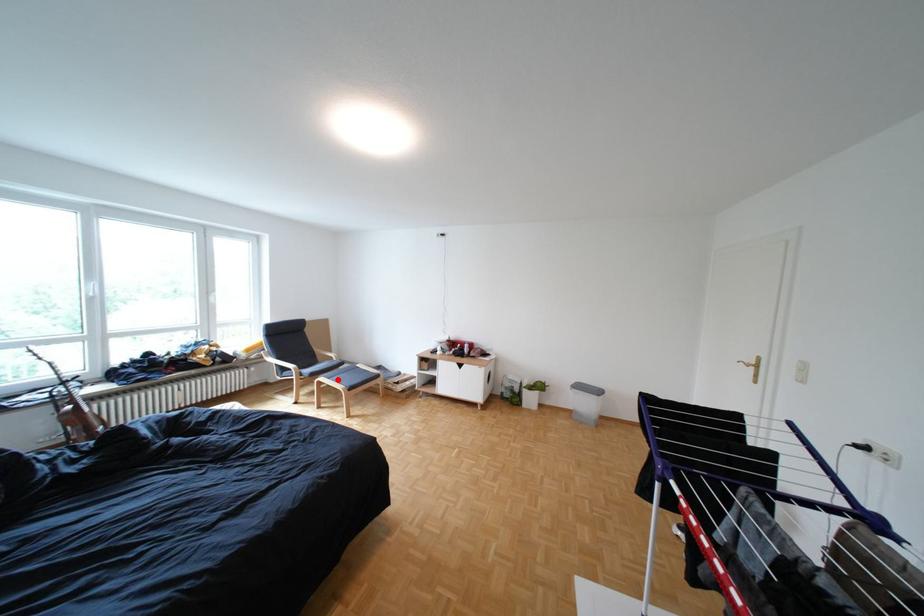
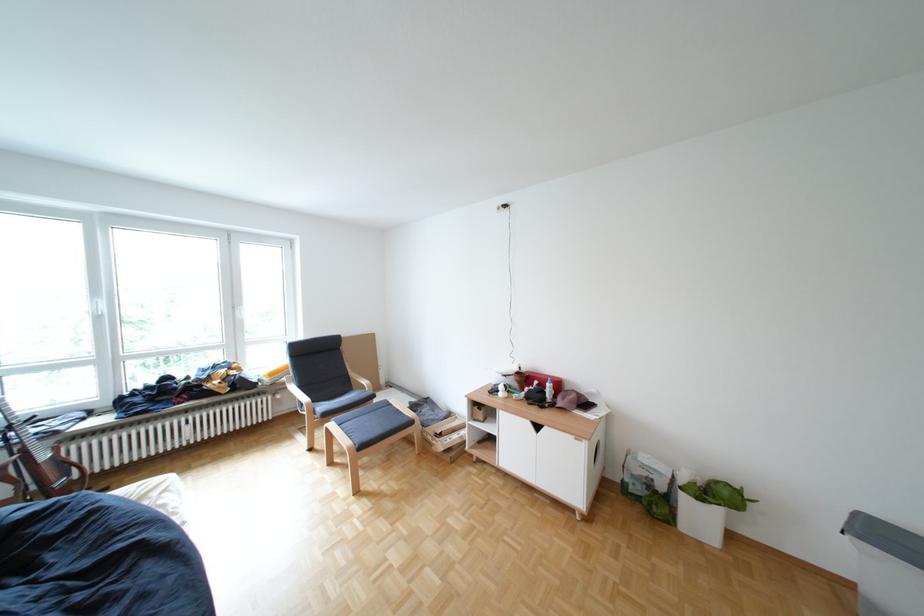
Find the pixel in the second image that matches the highlighted location in the first image.

(346, 424)